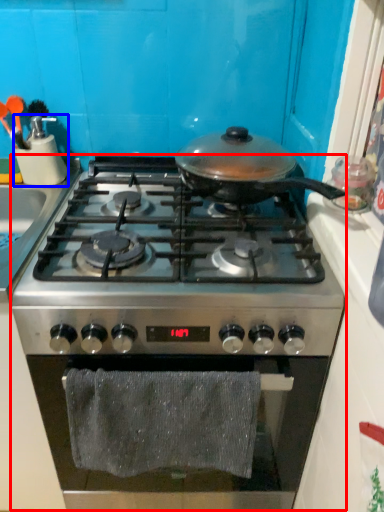
Question: Which object is closer to the camera taking this photo, gas stove (highlighted by a red box) or kitchen appliance (highlighted by a blue box)?

Choices:
 (A) gas stove
 (B) kitchen appliance

Answer: (A)